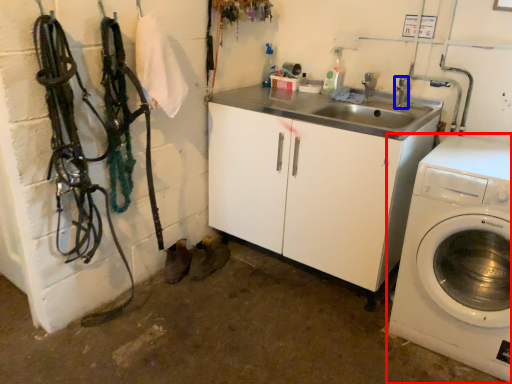
Question: Which point is closer to the camera, washing machine (highlighted by a red box) or faucet (highlighted by a blue box)?

Choices:
 (A) washing machine
 (B) faucet

Answer: (A)